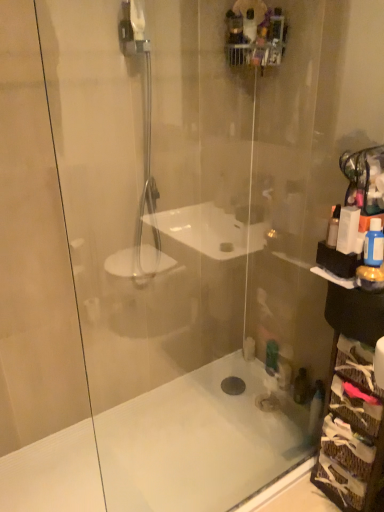
Question: Is white plastic bottle at right, the 3th toiletry in the right-to-left sequence, looking in the opposite direction of white plastic box at right, which is the 2th toiletry from right to left?

Choices:
 (A) yes
 (B) no

Answer: (B)

Question: Is white plastic bottle at right, the first toiletry when ordered from left to right, bigger than white plastic box at right, the 2th toiletry when ordered from left to right?

Choices:
 (A) no
 (B) yes

Answer: (A)

Question: Is white plastic bottle at right, the first toiletry when ordered from left to right, completely or partially outside of white plastic box at right, the 2th toiletry when ordered from left to right?

Choices:
 (A) yes
 (B) no

Answer: (A)

Question: Can you confirm if white plastic bottle at right, the first toiletry when ordered from left to right, is positioned to the right of white plastic box at right, which is the 2th toiletry from right to left?

Choices:
 (A) no
 (B) yes

Answer: (A)

Question: Are white plastic bottle at right, the 3th toiletry in the right-to-left sequence, and white plastic box at right, which is the 2th toiletry from right to left, located far from each other?

Choices:
 (A) yes
 (B) no

Answer: (B)

Question: Is white plastic bottle at right, the first toiletry when ordered from left to right, touching white plastic box at right, the 2th toiletry when ordered from left to right?

Choices:
 (A) yes
 (B) no

Answer: (A)

Question: Considering the relative sizes of white plastic bottle at right, the first toiletry when ordered from left to right, and blue glossy bottle at right, arranged as the 1th toiletry when viewed from the right, in the image provided, is white plastic bottle at right, the first toiletry when ordered from left to right, thinner than blue glossy bottle at right, arranged as the 1th toiletry when viewed from the right,?

Choices:
 (A) yes
 (B) no

Answer: (A)

Question: Does white plastic bottle at right, the 3th toiletry in the right-to-left sequence, come behind blue glossy bottle at right, the third toiletry in the left-to-right sequence?

Choices:
 (A) yes
 (B) no

Answer: (A)

Question: Does white plastic bottle at right, the first toiletry when ordered from left to right, have a smaller size compared to blue glossy bottle at right, the third toiletry in the left-to-right sequence?

Choices:
 (A) yes
 (B) no

Answer: (A)

Question: Is white plastic bottle at right, the first toiletry when ordered from left to right, to the right of blue glossy bottle at right, the third toiletry in the left-to-right sequence, from the viewer's perspective?

Choices:
 (A) yes
 (B) no

Answer: (B)

Question: From the image's perspective, is white plastic bottle at right, the first toiletry when ordered from left to right, located beneath blue glossy bottle at right, the third toiletry in the left-to-right sequence?

Choices:
 (A) yes
 (B) no

Answer: (B)

Question: Is white plastic bottle at right, the 3th toiletry in the right-to-left sequence, bigger than blue glossy bottle at right, arranged as the 1th toiletry when viewed from the right?

Choices:
 (A) yes
 (B) no

Answer: (B)

Question: Can you confirm if white plastic box at right, the 2th toiletry when ordered from left to right, is smaller than white plastic bottle at right, the 3th toiletry in the right-to-left sequence?

Choices:
 (A) no
 (B) yes

Answer: (A)